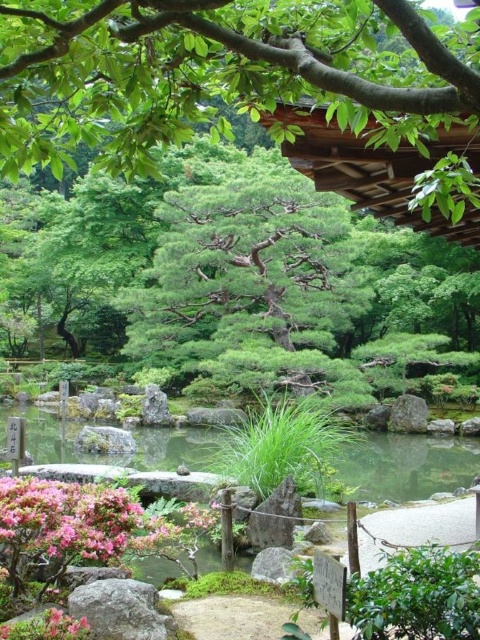
Does green stone pond at center have a smaller size compared to pink matte flowers at lower left?

No.

Is green stone pond at center shorter than pink matte flowers at lower left?

No.

Measure the distance between point (x=372, y=486) and camera.

A distance of 13.57 meters exists between point (x=372, y=486) and camera.

Image resolution: width=480 pixels, height=640 pixels. Find the location of `green stone pond at center`. green stone pond at center is located at coordinates (406, 465).

Who is shorter, green leafy tree at upper center or pink matte flowers at lower left?

pink matte flowers at lower left

Who is positioned more to the left, green leafy tree at upper center or pink matte flowers at lower left?

From the viewer's perspective, pink matte flowers at lower left appears more on the left side.

Which is in front, point (93, 33) or point (157, 513)?

Point (93, 33)

Find the location of `green leafy tree at upper center`. green leafy tree at upper center is located at coordinates (253, 92).

Between pink matte flowers at lower left and gray smooth rock at center-right, which one is positioned higher?

pink matte flowers at lower left

Between pink matte flowers at lower left and gray smooth rock at center-right, which one has less height?

pink matte flowers at lower left is shorter.

Is point (49, 548) more distant than point (405, 422)?

No, (49, 548) is in front of (405, 422).

Where is `pink matte flowers at lower left`? pink matte flowers at lower left is located at coordinates click(94, 522).